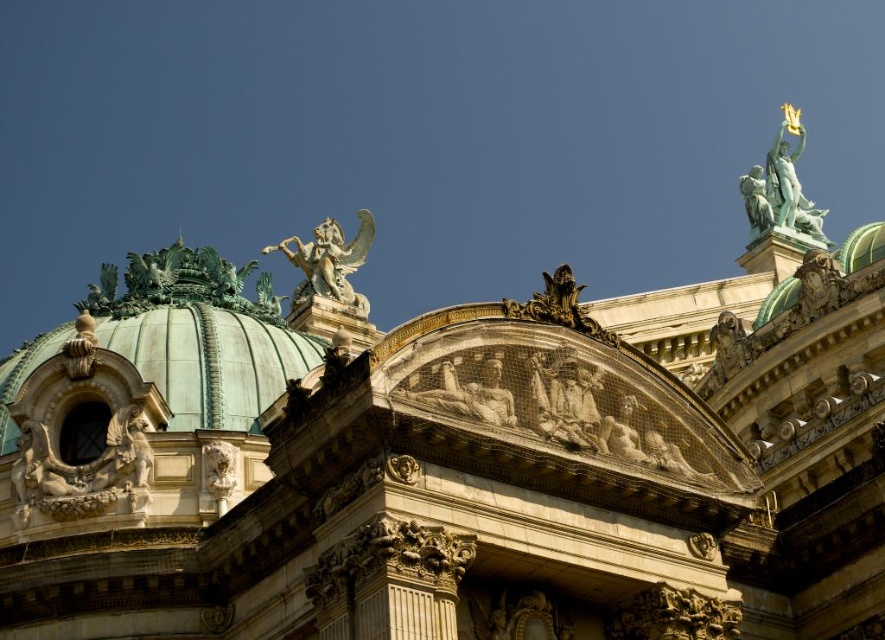
Question: Which point is farther to the camera?

Choices:
 (A) green stone winged creature at upper center
 (B) marble relief figure at center

Answer: (A)

Question: Which object is closer to the camera taking this photo?

Choices:
 (A) green stone winged creature at upper center
 (B) marble relief figure at center
 (C) green polished statue at upper right

Answer: (B)

Question: Is green polished statue at upper right to the left of marble relief figure at center from the viewer's perspective?

Choices:
 (A) no
 (B) yes

Answer: (A)

Question: Does green polished statue at upper right come behind marble relief figure at center?

Choices:
 (A) no
 (B) yes

Answer: (B)

Question: Can you confirm if green polished statue at upper right is positioned below marble relief figure at center?

Choices:
 (A) no
 (B) yes

Answer: (A)

Question: Among these objects, which one is nearest to the camera?

Choices:
 (A) green stone winged creature at upper center
 (B) green polished statue at upper right

Answer: (A)